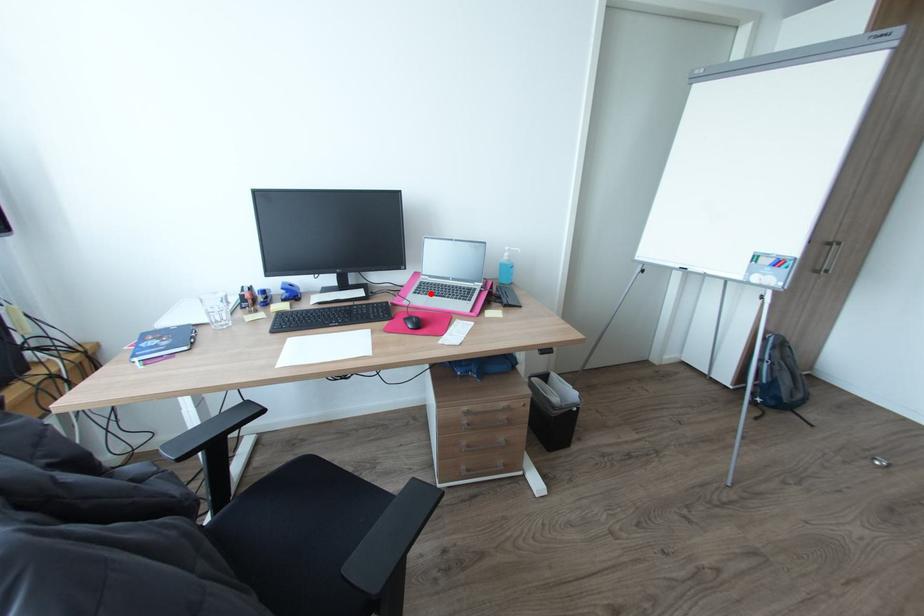
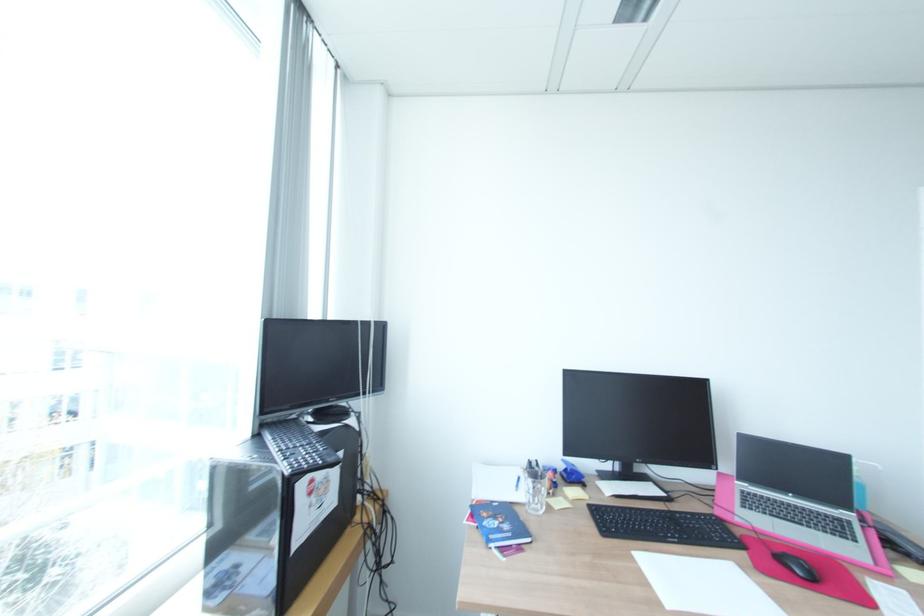
Where in the second image is the point corresponding to the highlighted location from the first image?

(770, 513)